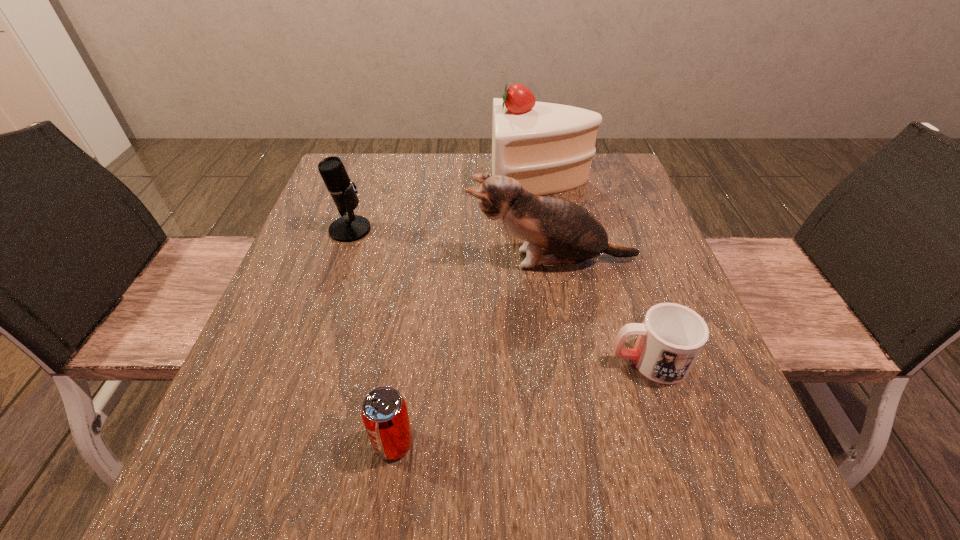
This screenshot has height=540, width=960. What are the coordinates of `cake` in the screenshot? It's located at (548, 148).

In order to click on the tallest object in this screenshot , I will do `click(548, 148)`.

The image size is (960, 540). Identify the location of cat. point(556,231).

You are a GUI agent. You are given a task and a screenshot of the screen. Output one action in this format:
    pyautogui.click(x=<x>, y=<y>)
    Task: Click on the second farthest object
    The image size is (960, 540).
    Given the screenshot: What is the action you would take?
    pyautogui.click(x=348, y=228)

At what (x,y) coordinates should I click in order to perform the action: click on the leftmost object. Please return your answer as a coordinate pair (x, y). This screenshot has height=540, width=960. Looking at the image, I should click on (348, 228).

Find the location of a particular element. the nearest object is located at coordinates (384, 412).

Where is `soda can`? soda can is located at coordinates (384, 412).

Find the location of a particular element. The width and height of the screenshot is (960, 540). the shortest object is located at coordinates click(670, 339).

The image size is (960, 540). I want to click on the second nearest object, so click(x=670, y=339).

The height and width of the screenshot is (540, 960). Find the location of `vacant region located 0.270m on the left of the cake`. vacant region located 0.270m on the left of the cake is located at coordinates (393, 181).